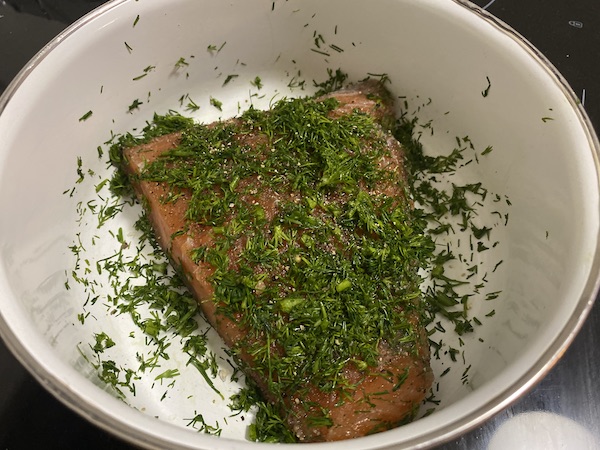
Where is `plate`? The width and height of the screenshot is (600, 450). plate is located at coordinates (559, 230).